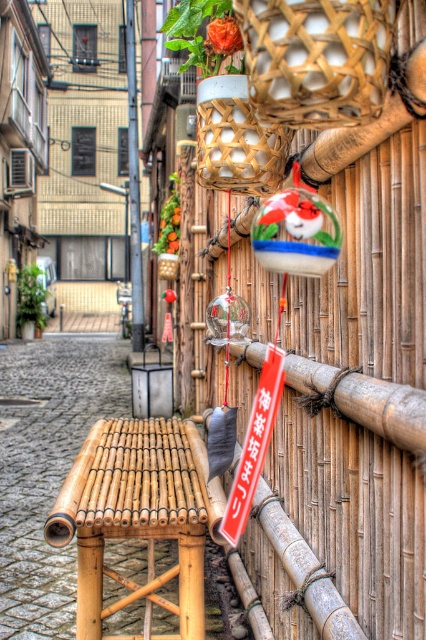
Question: Does bamboo sign at center appear on the right side of red plastic sign at center?

Choices:
 (A) yes
 (B) no

Answer: (B)

Question: Among these points, which one is nearest to the camera?

Choices:
 (A) (261, 493)
 (B) (268, 400)
 (C) (268, 150)

Answer: (C)

Question: Among these objects, which one is farthest from the camera?

Choices:
 (A) bamboo woven basket at center
 (B) bamboo sign at center

Answer: (B)

Question: Where is bamboo at center located in relation to bamboo sign at center in the image?

Choices:
 (A) below
 (B) above

Answer: (B)

Question: Which object appears farthest from the camera in this image?

Choices:
 (A) metallic pole at upper center
 (B) bamboo woven basket at upper center
 (C) bamboo at center

Answer: (A)

Question: Can you confirm if bamboo sign at center is thinner than metallic pole at upper center?

Choices:
 (A) yes
 (B) no

Answer: (A)